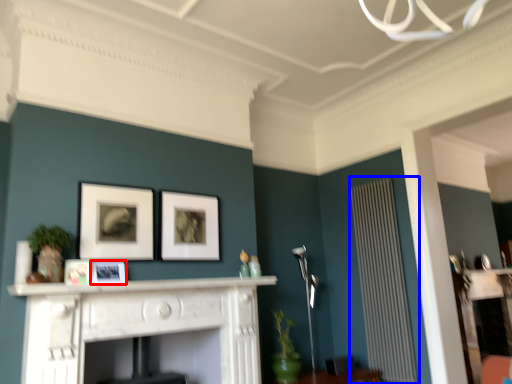
Question: Among these objects, which one is farthest to the camera, picture frame (highlighted by a red box) or radiator (highlighted by a blue box)?

Choices:
 (A) picture frame
 (B) radiator

Answer: (B)